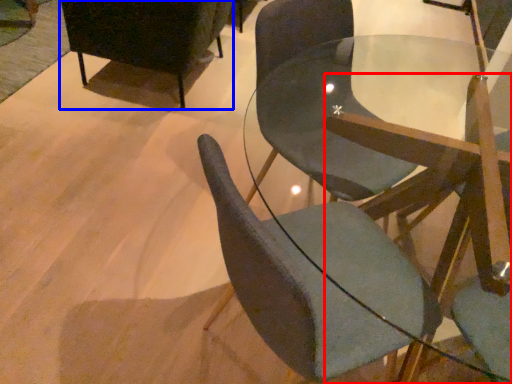
Question: Which of the following is the closest to the observer, chair (highlighted by a red box) or chair (highlighted by a blue box)?

Choices:
 (A) chair
 (B) chair

Answer: (A)